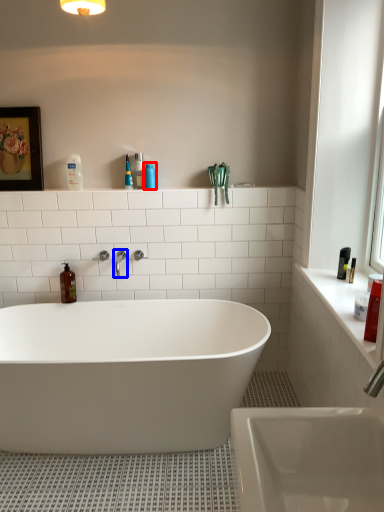
Question: Which object appears farthest to the camera in this image, cleaning product (highlighted by a red box) or tap (highlighted by a blue box)?

Choices:
 (A) cleaning product
 (B) tap

Answer: (A)